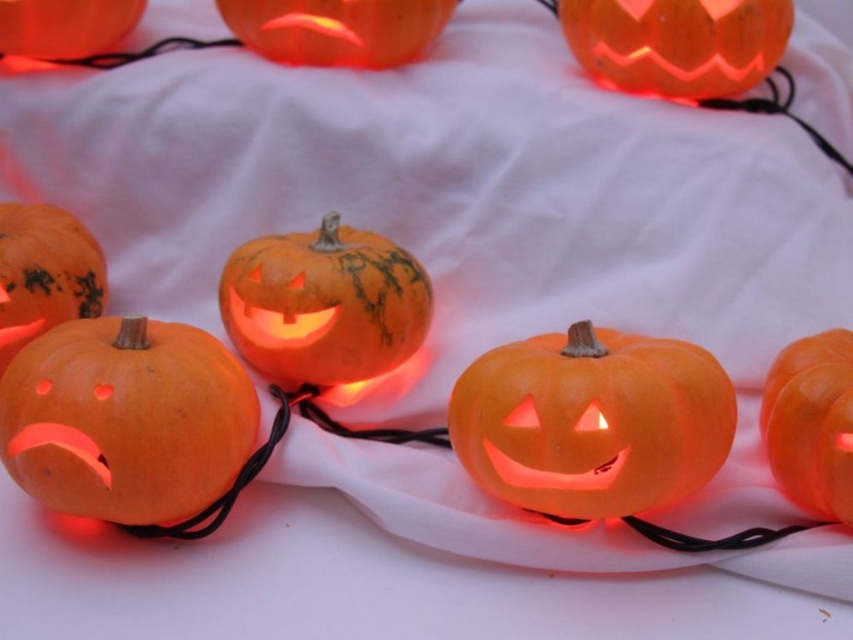
Question: Is orange matte pumpkin at center above orange matte carved pumpkin at center?

Choices:
 (A) yes
 (B) no

Answer: (B)

Question: Based on their relative distances, which object is nearer to the orange matte pumpkin at center?

Choices:
 (A) orange matte carved pumpkin at center
 (B) orange matte carved pumpkin at upper right

Answer: (A)

Question: Which of the following is the closest to the observer?

Choices:
 (A) (241, 417)
 (B) (384, 32)
 (C) (817, 406)

Answer: (C)

Question: Based on their relative distances, which object is nearer to the orange matte carved pumpkin at center?

Choices:
 (A) matte orange pumpkin at left
 (B) orange matte carved pumpkin at upper right
 (C) orange matte pumpkin at upper center

Answer: (A)

Question: Is orange matte pumpkin at center below orange matte pumpkin at right?

Choices:
 (A) yes
 (B) no

Answer: (B)

Question: Is orange matte carved pumpkin at center smaller than orange matte pumpkin at upper center?

Choices:
 (A) no
 (B) yes

Answer: (A)